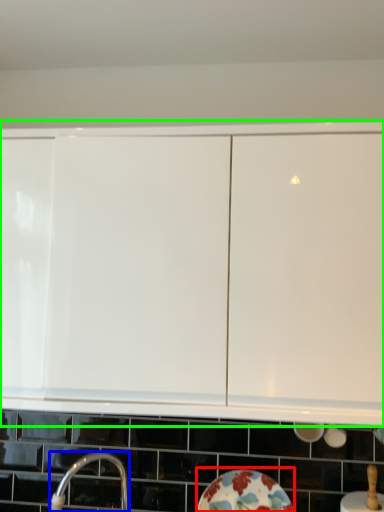
Question: Based on their relative distances, which object is nearer to plate (highlighted by a red box)? Choose from tap (highlighted by a blue box) and cabinetry (highlighted by a green box).

Choices:
 (A) tap
 (B) cabinetry

Answer: (A)